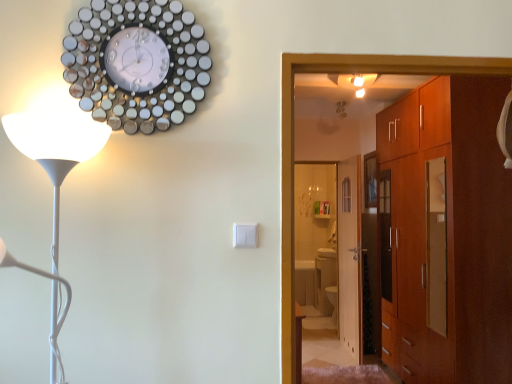
Question: Is matte brown cabinet at right to the left of white glossy floor lamp at left from the viewer's perspective?

Choices:
 (A) yes
 (B) no

Answer: (B)

Question: Can you confirm if matte brown cabinet at right is thinner than white glossy floor lamp at left?

Choices:
 (A) no
 (B) yes

Answer: (A)

Question: Considering the relative positions of matte brown cabinet at right and white glossy floor lamp at left in the image provided, is matte brown cabinet at right behind white glossy floor lamp at left?

Choices:
 (A) yes
 (B) no

Answer: (A)

Question: Is there a large distance between matte brown cabinet at right and white glossy floor lamp at left?

Choices:
 (A) no
 (B) yes

Answer: (B)

Question: Considering the relative sizes of matte brown cabinet at right and white glossy floor lamp at left in the image provided, is matte brown cabinet at right smaller than white glossy floor lamp at left?

Choices:
 (A) no
 (B) yes

Answer: (A)

Question: Could you tell me if matte brown cabinet at right is facing white glossy floor lamp at left?

Choices:
 (A) yes
 (B) no

Answer: (B)

Question: Is the position of white glossy floor lamp at left less distant than that of wooden door at center?

Choices:
 (A) yes
 (B) no

Answer: (A)

Question: Is white glossy floor lamp at left not inside wooden door at center?

Choices:
 (A) yes
 (B) no

Answer: (A)

Question: Can you confirm if white glossy floor lamp at left is positioned to the left of wooden door at center?

Choices:
 (A) yes
 (B) no

Answer: (A)

Question: Does white glossy floor lamp at left have a lesser width compared to wooden door at center?

Choices:
 (A) yes
 (B) no

Answer: (B)

Question: From the image's perspective, is white glossy floor lamp at left below wooden door at center?

Choices:
 (A) no
 (B) yes

Answer: (A)

Question: From a real-world perspective, is white glossy floor lamp at left physically above wooden door at center?

Choices:
 (A) yes
 (B) no

Answer: (A)

Question: Does white glossy floor lamp at left have a lesser width compared to metallic circular clock at upper left?

Choices:
 (A) yes
 (B) no

Answer: (B)